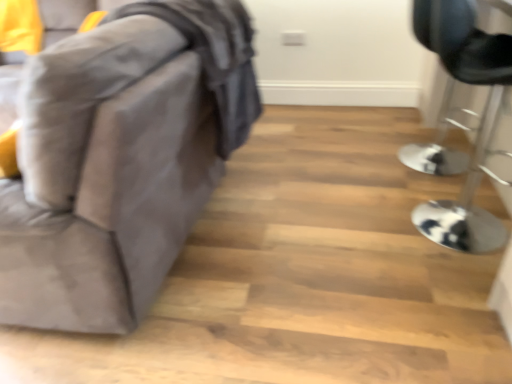
Question: Looking at their shapes, would you say velvet gray sofa at left, positioned as the 1th furniture in left-to-right order, is wider or thinner than metallic silver bar stool at right, which is the first furniture in right-to-left order?

Choices:
 (A) wide
 (B) thin

Answer: (A)

Question: Relative to metallic silver bar stool at right, which is the first furniture in right-to-left order, is velvet gray sofa at left, positioned as the 1th furniture in left-to-right order, in front or behind?

Choices:
 (A) front
 (B) behind

Answer: (A)

Question: Is velvet gray sofa at left, positioned as the 1th furniture in left-to-right order, taller or shorter than metallic silver bar stool at right, which is the first furniture in right-to-left order?

Choices:
 (A) short
 (B) tall

Answer: (B)

Question: In the image, is metallic silver bar stool at right, which is counted as the second furniture, starting from the left, positioned in front of or behind velvet gray sofa at left, positioned as the 1th furniture in left-to-right order?

Choices:
 (A) behind
 (B) front

Answer: (A)

Question: Is point (470, 11) positioned closer to the camera than point (106, 211)?

Choices:
 (A) farther
 (B) closer

Answer: (A)

Question: Considering the positions of metallic silver bar stool at right, which is counted as the second furniture, starting from the left, and velvet gray sofa at left, positioned as the 1th furniture in left-to-right order, in the image, is metallic silver bar stool at right, which is counted as the second furniture, starting from the left, wider or thinner than velvet gray sofa at left, positioned as the 1th furniture in left-to-right order,?

Choices:
 (A) thin
 (B) wide

Answer: (A)

Question: From the image's perspective, is metallic silver bar stool at right, which is counted as the second furniture, starting from the left, above or below velvet gray sofa at left, positioned as the 1th furniture in left-to-right order?

Choices:
 (A) above
 (B) below

Answer: (B)